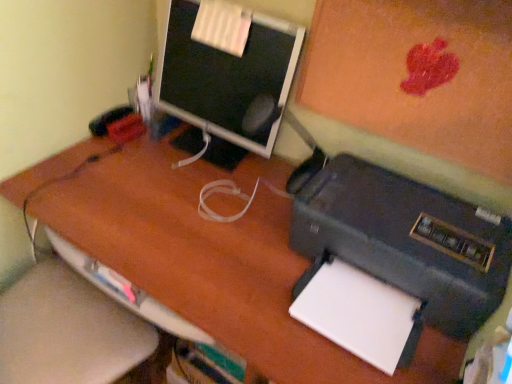
In order to face white paper at lower right, should I rotate leftwards or rightwards?

To face it directly, rotate right by 13.751 degrees.

In order to face black matte printer at lower right, should I rotate leftwards or rightwards?

To align with it, rotate right about 16.960°.

What is the approximate width of black matte printer at lower right?

black matte printer at lower right is 18.54 inches in width.

The image size is (512, 384). I want to click on matte orange bulletin board at upper right, so click(408, 74).

Could you tell me if matte black monitor at upper center is facing black matte printer at lower right?

No, matte black monitor at upper center is not turned towards black matte printer at lower right.

From the image's perspective, is matte black monitor at upper center under black matte printer at lower right?

No.

Measure the distance from matte black monitor at upper center to black matte printer at lower right.

They are 15.04 inches apart.

Based on their sizes in the image, would you say matte black monitor at upper center is bigger or smaller than black matte printer at lower right?

matte black monitor at upper center is smaller than black matte printer at lower right.

Is matte orange bulletin board at upper right positioned behind black matte printer at lower right?

That is True.

From the picture: Can we say matte orange bulletin board at upper right lies outside black matte printer at lower right?

That's correct, matte orange bulletin board at upper right is outside of black matte printer at lower right.

Does matte orange bulletin board at upper right appear on the left side of black matte printer at lower right?

No.

In the scene shown: From a real-world perspective, between matte orange bulletin board at upper right and black matte printer at lower right, who is vertically higher?

matte orange bulletin board at upper right.

Between matte orange bulletin board at upper right and matte black monitor at upper center, which one has less height?

With less height is matte black monitor at upper center.

From a real-world perspective, is matte orange bulletin board at upper right physically above matte black monitor at upper center?

Yes, from a real-world perspective, matte orange bulletin board at upper right is over matte black monitor at upper center

From the image's perspective, would you say matte orange bulletin board at upper right is shown under matte black monitor at upper center?

Correct, matte orange bulletin board at upper right appears lower than matte black monitor at upper center in the image.

Would you say matte orange bulletin board at upper right is to the left or to the right of matte black monitor at upper center in the picture?

matte orange bulletin board at upper right is to the right of matte black monitor at upper center.

Does matte orange bulletin board at upper right appear on the left side of white paper at lower right?

Incorrect, matte orange bulletin board at upper right is not on the left side of white paper at lower right.

From a real-world perspective, does matte orange bulletin board at upper right stand above white paper at lower right?

Yes, from a real-world perspective, matte orange bulletin board at upper right is above white paper at lower right.

Is matte orange bulletin board at upper right surrounding white paper at lower right?

Actually, white paper at lower right is outside matte orange bulletin board at upper right.

In the scene shown: How much distance is there between white paper at lower right and matte black monitor at upper center?

white paper at lower right is 20.95 inches away from matte black monitor at upper center.

Can you confirm if white paper at lower right is taller than matte black monitor at upper center?

Incorrect, the height of white paper at lower right is not larger of that of matte black monitor at upper center.

From the image's perspective, between white paper at lower right and matte black monitor at upper center, who is located below?

white paper at lower right.

Considering the positions of point (413, 310) and point (284, 114), is point (413, 310) closer or farther from the camera than point (284, 114)?

Point (413, 310) appears to be closer to the viewer than point (284, 114).

Can you confirm if black matte printer at lower right is wider than white paper at lower right?

Yes, black matte printer at lower right is wider than white paper at lower right.

Can you confirm if black matte printer at lower right is shorter than white paper at lower right?

In fact, black matte printer at lower right may be taller than white paper at lower right.

Is black matte printer at lower right facing towards white paper at lower right?

No, black matte printer at lower right is not aimed at white paper at lower right.

How distant is black matte printer at lower right from white paper at lower right?

5.24 inches.

Who is bigger, matte black monitor at upper center or matte orange bulletin board at upper right?

With larger size is matte orange bulletin board at upper right.

Looking at this image, between matte black monitor at upper center and matte orange bulletin board at upper right, which one appears on the right side from the viewer's perspective?

matte orange bulletin board at upper right is more to the right.

Which is closer, (270, 68) or (448, 106)?

Point (270, 68) is positioned farther from the camera compared to point (448, 106).

From a real-world perspective, is matte black monitor at upper center above or below matte orange bulletin board at upper right?

In terms of real-world spatial position, matte black monitor at upper center is below matte orange bulletin board at upper right.

There is a black matte printer at lower right. At what (x,y) coordinates should I click in order to perform the action: click on computer monitor above it (from a real-world perspective). Please return your answer as a coordinate pair (x, y). Image resolution: width=512 pixels, height=384 pixels. Looking at the image, I should click on (228, 78).

The width and height of the screenshot is (512, 384). I want to click on printer that is in front of the matte orange bulletin board at upper right, so click(405, 238).

Based on their spatial positions, is white paper at lower right or matte orange bulletin board at upper right closer to matte black monitor at upper center?

Among the two, matte orange bulletin board at upper right is located nearer to matte black monitor at upper center.

Estimate the real-world distances between objects in this image. Which object is closer to matte black monitor at upper center, matte orange bulletin board at upper right or white paper at lower right?

matte orange bulletin board at upper right.

From the picture: Looking at the image, which one is located further to matte black monitor at upper center, white paper at lower right or black matte printer at lower right?

Based on the image, white paper at lower right appears to be further to matte black monitor at upper center.

Based on their spatial positions, is black matte printer at lower right or matte black monitor at upper center further from matte orange bulletin board at upper right?

The object further to matte orange bulletin board at upper right is matte black monitor at upper center.

When comparing their distances from black matte printer at lower right, does white paper at lower right or matte black monitor at upper center seem further?

matte black monitor at upper center lies further to black matte printer at lower right than the other object.

From the image, which object appears to be farther from white paper at lower right, black matte printer at lower right or matte orange bulletin board at upper right?

matte orange bulletin board at upper right is positioned further to the anchor white paper at lower right.

Based on their spatial positions, is matte black monitor at upper center or black matte printer at lower right closer to white paper at lower right?

black matte printer at lower right lies closer to white paper at lower right than the other object.

In the scene shown: When comparing their distances from matte orange bulletin board at upper right, does matte black monitor at upper center or black matte printer at lower right seem closer?

black matte printer at lower right is closer to matte orange bulletin board at upper right.

The height and width of the screenshot is (384, 512). In order to click on printer between matte black monitor at upper center and white paper at lower right in the up-down direction in this screenshot , I will do `click(405, 238)`.

Identify the location of bulletin board that lies between matte black monitor at upper center and white paper at lower right from top to bottom. (408, 74).

At what (x,y) coordinates should I click in order to perform the action: click on printer that lies between matte orange bulletin board at upper right and white paper at lower right from top to bottom. Please return your answer as a coordinate pair (x, y). The height and width of the screenshot is (384, 512). Looking at the image, I should click on 405,238.

You are a GUI agent. You are given a task and a screenshot of the screen. Output one action in this format:
    pyautogui.click(x=<x>, y=<y>)
    Task: Click on the printer between matte black monitor at upper center and matte orange bulletin board at upper right
    The height and width of the screenshot is (384, 512).
    Given the screenshot: What is the action you would take?
    pyautogui.click(x=405, y=238)